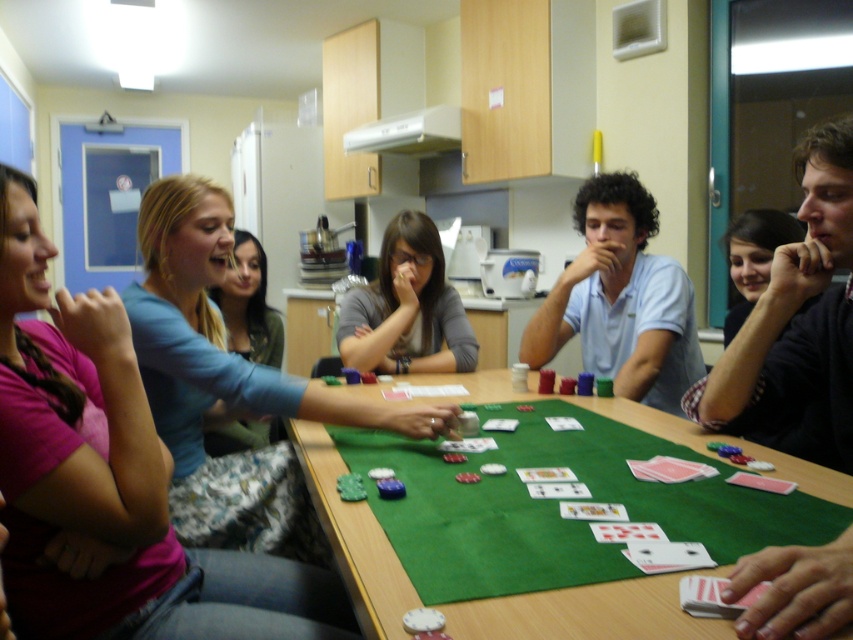
Question: Observing the image, what is the correct spatial positioning of black matte shirt at center in reference to light blue shirt at center?

Choices:
 (A) below
 (B) above

Answer: (A)

Question: Is pink fabric shirt at left positioned in front of light blue fabric shirt at upper left?

Choices:
 (A) no
 (B) yes

Answer: (B)

Question: Is light blue shirt at center positioned in front of dark blue shirt at upper right?

Choices:
 (A) yes
 (B) no

Answer: (A)

Question: Which point is farther to the camera?

Choices:
 (A) (846, 604)
 (B) (347, 324)
 (C) (13, 582)
 (D) (796, 236)

Answer: (B)

Question: Estimate the real-world distances between objects in this image. Which object is closer to the dark blue shirt at upper right?

Choices:
 (A) green felt table at center
 (B) pink fabric shirt at left
 (C) light blue shirt at center
 (D) blue fabric shirt at center

Answer: (C)

Question: Among these objects, which one is farthest from the camera?

Choices:
 (A) matte gray shirt at center
 (B) light blue shirt at center
 (C) black matte shirt at center
 (D) blue fabric shirt at center

Answer: (A)